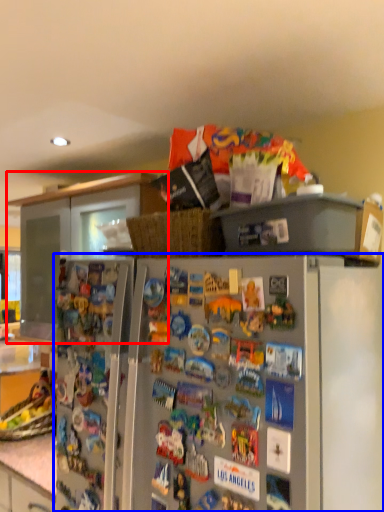
Question: Which point is closer to the camera, cabinetry (highlighted by a red box) or refrigerator (highlighted by a blue box)?

Choices:
 (A) cabinetry
 (B) refrigerator

Answer: (B)